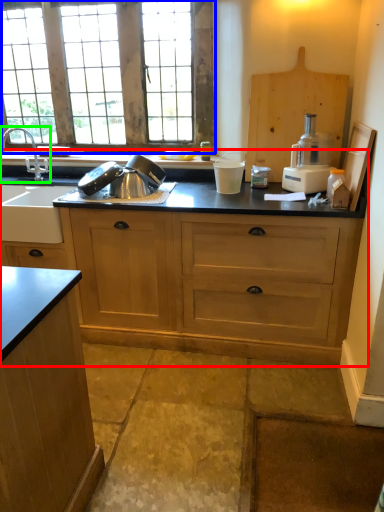
Question: Which object is positioned farthest from countertop (highlighted by a red box)? Select from window (highlighted by a blue box) and tap (highlighted by a green box).

Choices:
 (A) window
 (B) tap

Answer: (B)